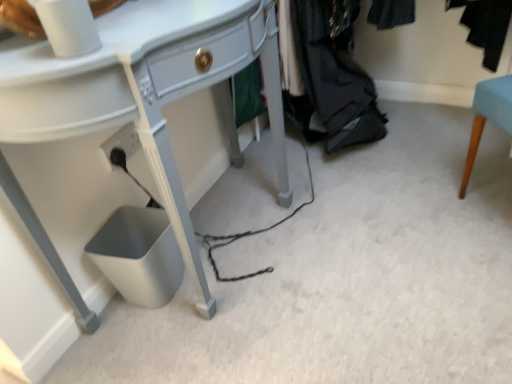
I want to click on vacant space to the right of dark gray fabric at lower right, so click(432, 133).